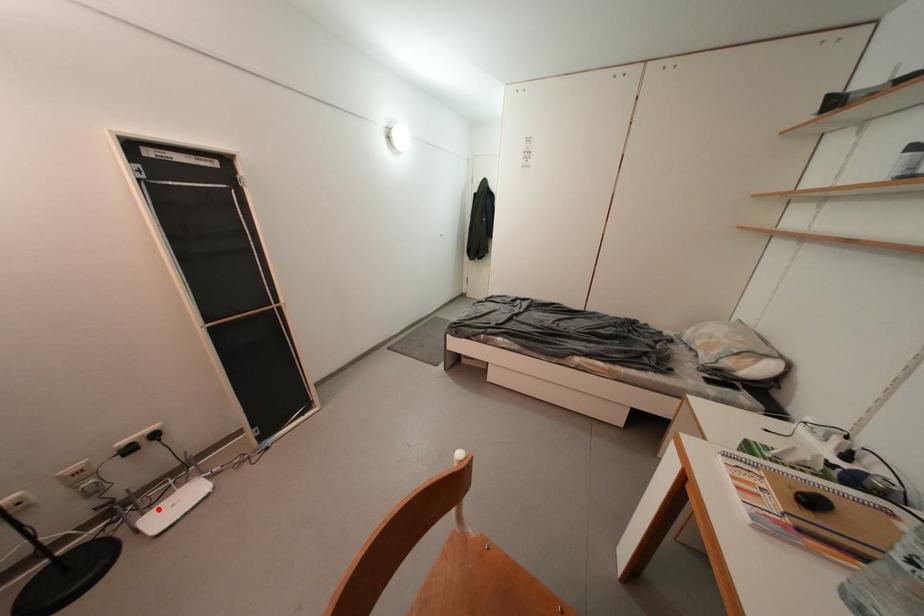
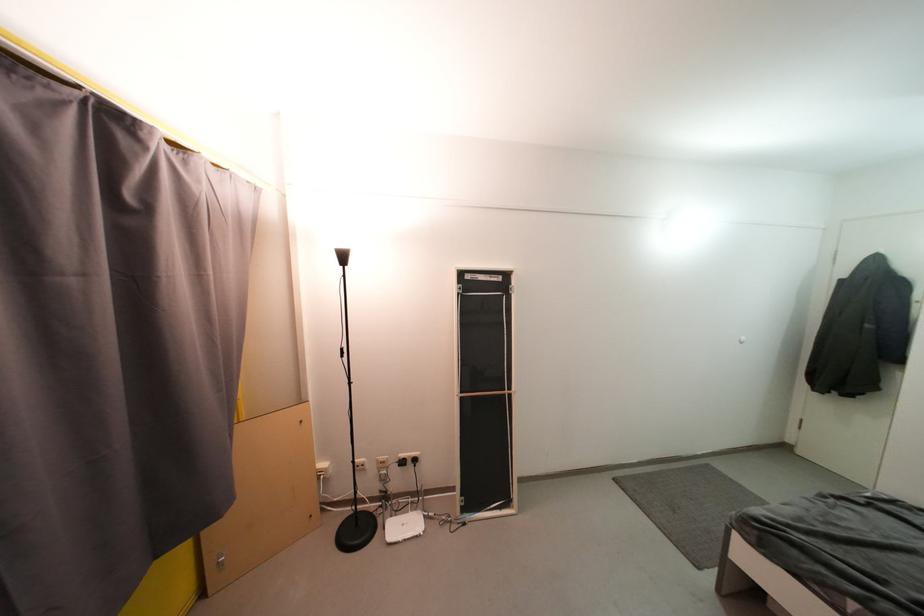
Question: A red point is marked in image1. In image2, is the corresponding 3D point closer to the camera or farther? Reply with the corresponding letter.

Choices:
 (A) The corresponding 3D point is closer.
 (B) The corresponding 3D point is farther.

Answer: (B)